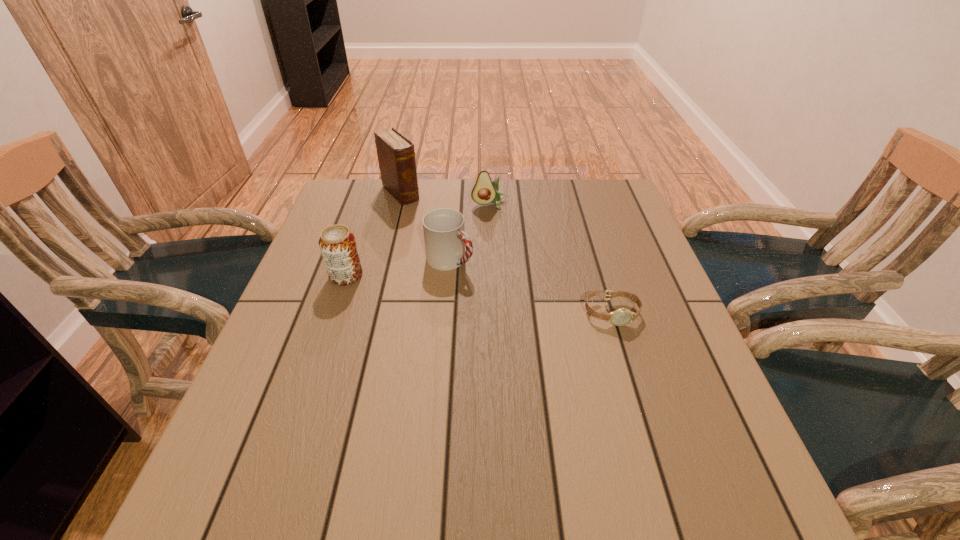
The height and width of the screenshot is (540, 960). Find the location of `vacant position in the image that satisfies the following two spatial constraints: 1. on the back side of the beer can; 2. on the left side of the cup`. vacant position in the image that satisfies the following two spatial constraints: 1. on the back side of the beer can; 2. on the left side of the cup is located at coordinates (351, 260).